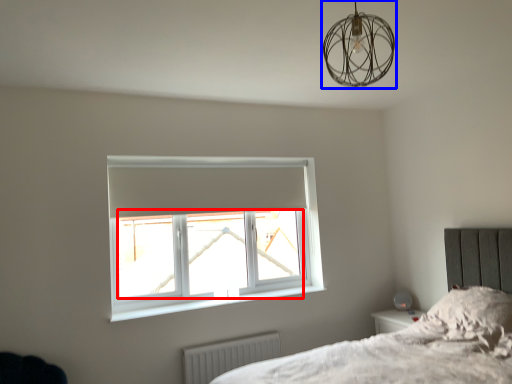
Question: Which of the following is the closest to the observer, window screen (highlighted by a red box) or lamp (highlighted by a blue box)?

Choices:
 (A) window screen
 (B) lamp

Answer: (B)